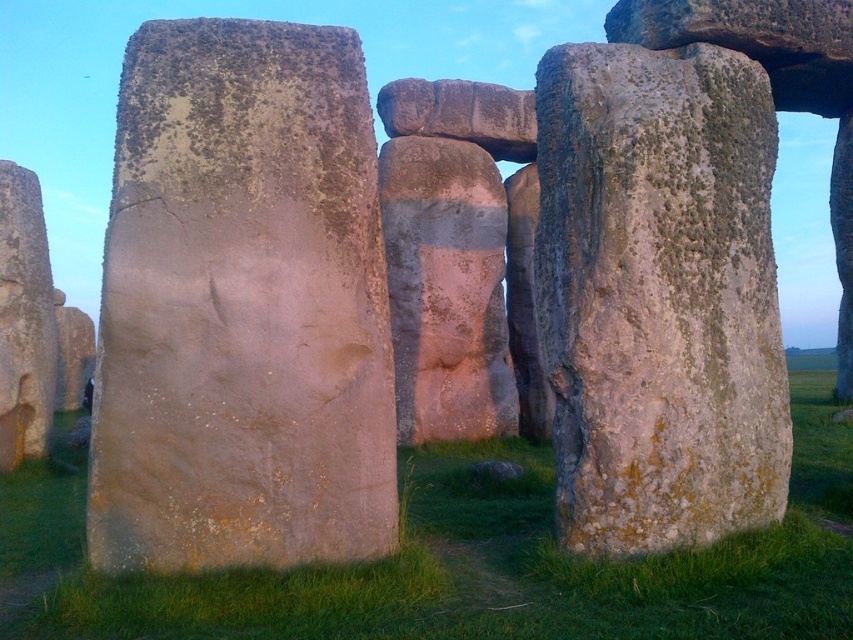
Is point (314, 520) positioned before point (619, 600)?

No, (314, 520) is behind (619, 600).

You are a GUI agent. You are given a task and a screenshot of the screen. Output one action in this format:
    pyautogui.click(x=<x>, y=<y>)
    Task: Click on the rusty stone boulder at center
    The image size is (853, 640).
    Given the screenshot: What is the action you would take?
    pyautogui.click(x=242, y=307)

Image resolution: width=853 pixels, height=640 pixels. In order to click on rusty stone boulder at center in this screenshot , I will do `click(242, 307)`.

Is rusty stone boulder at center bigger than speckled stone boulder at center?

Actually, rusty stone boulder at center might be smaller than speckled stone boulder at center.

Who is more forward, [239,538] or [602,326]?

Point [239,538]

Is point (373, 508) behind point (729, 413)?

No.

You are a GUI agent. You are given a task and a screenshot of the screen. Output one action in this format:
    pyautogui.click(x=<x>, y=<y>)
    Task: Click on the rusty stone boulder at center
    This screenshot has height=640, width=853.
    Given the screenshot: What is the action you would take?
    pyautogui.click(x=242, y=307)

Which is more to the right, speckled stone boulder at center or green grass at center?

speckled stone boulder at center is more to the right.

Is point (657, 444) farther from camera compared to point (674, 589)?

Yes, point (657, 444) is behind point (674, 589).

This screenshot has height=640, width=853. What do you see at coordinates (659, 296) in the screenshot? I see `speckled stone boulder at center` at bounding box center [659, 296].

Identify the location of speckled stone boulder at center. This screenshot has width=853, height=640. pyautogui.click(x=659, y=296).